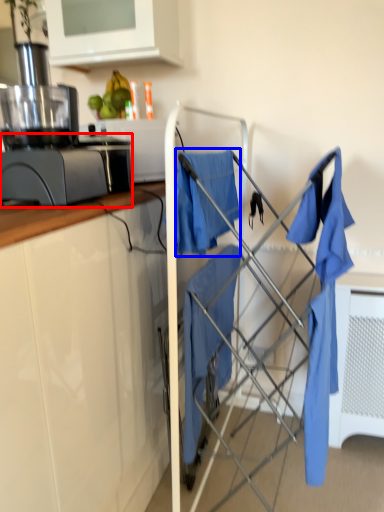
Question: Which object appears closest to the camera in this image, kitchen appliance (highlighted by a red box) or clothe (highlighted by a blue box)?

Choices:
 (A) kitchen appliance
 (B) clothe

Answer: (B)